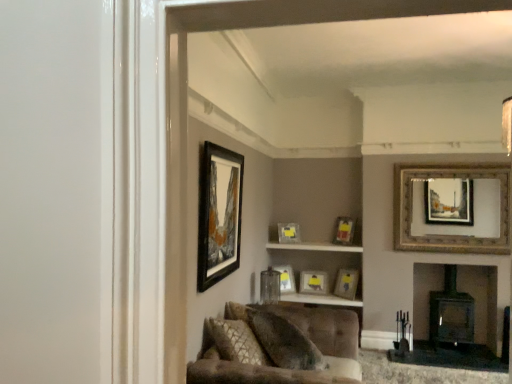
I want to click on free space above matte glass picture frame at center, the sixth picture frame from the right (from a real-world perspective), so click(x=280, y=266).